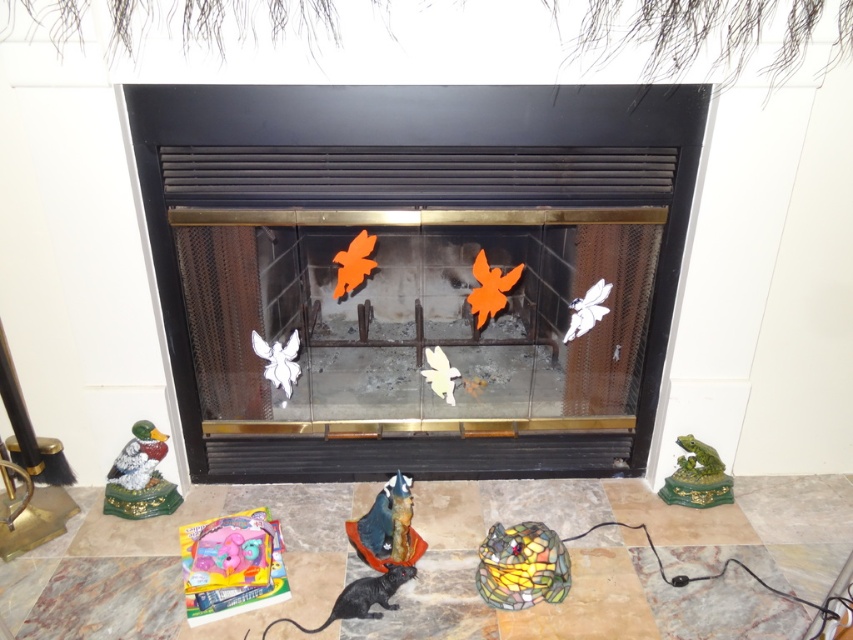
Question: Which point appears closest to the camera in this image?

Choices:
 (A) (120, 460)
 (B) (695, 467)
 (C) (241, 104)

Answer: (C)

Question: Where is shiny metallic cat at center located in relation to white matte butterfly at center in the image?

Choices:
 (A) above
 (B) below

Answer: (B)

Question: Estimate the real-world distances between objects in this image. Which object is farther from the green glossy frog at lower right?

Choices:
 (A) orange paper fairies at center
 (B) translucent plastic toy at lower left
 (C) shiny green and gold duck at lower left

Answer: (C)

Question: Does orange paper fairies at center appear over white matte butterfly at center?

Choices:
 (A) no
 (B) yes

Answer: (B)

Question: Can you confirm if orange paper fairies at center is smaller than green glossy frog at lower right?

Choices:
 (A) no
 (B) yes

Answer: (A)

Question: Which of the following is the farthest from the observer?

Choices:
 (A) (308, 632)
 (B) (123, 492)

Answer: (B)